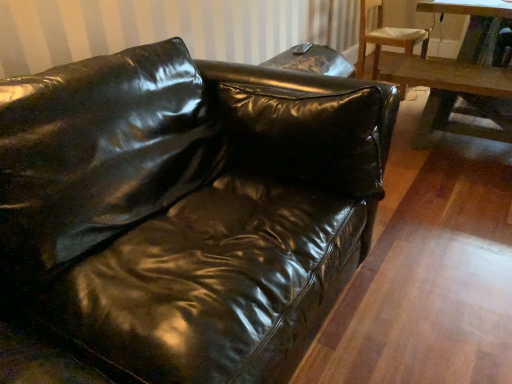
Question: Is wooden table at right taller or shorter than glossy leather couch at center?

Choices:
 (A) short
 (B) tall

Answer: (B)

Question: From a real-world perspective, is wooden table at right physically located above or below glossy leather couch at center?

Choices:
 (A) below
 (B) above

Answer: (B)

Question: Considering the real-world distances, which object is farthest from the wooden chair at upper right?

Choices:
 (A) wooden table at right
 (B) glossy leather couch at center

Answer: (B)

Question: Which of these objects is positioned farthest from the wooden table at right?

Choices:
 (A) wooden chair at upper right
 (B) glossy leather couch at center

Answer: (B)